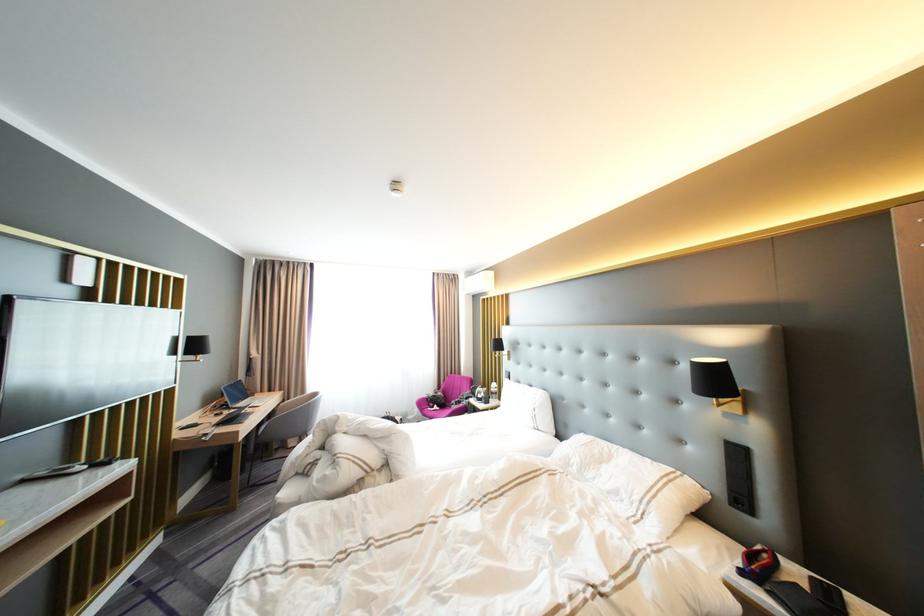
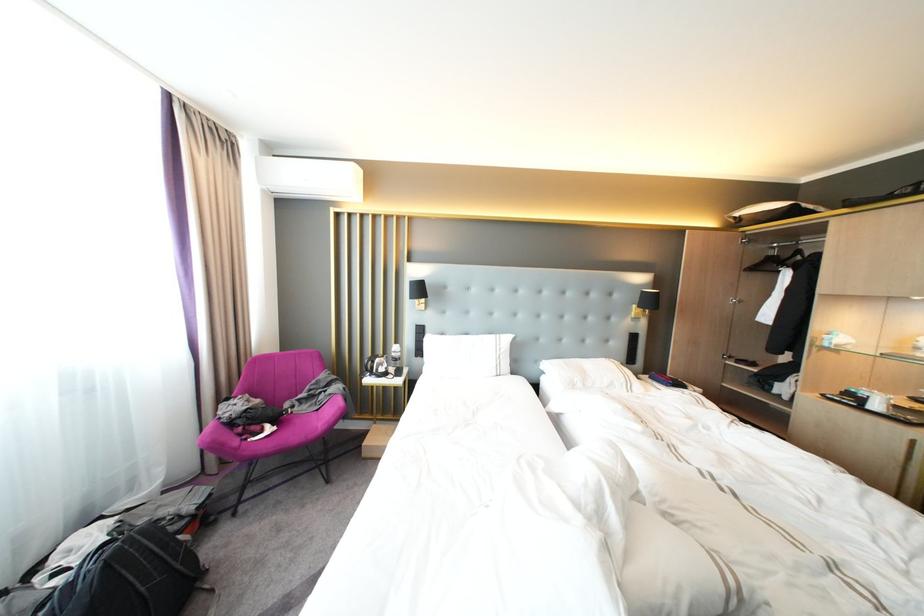
Locate, in the second image, the point that corresponds to the point at 582,462 in the first image.

(586, 382)